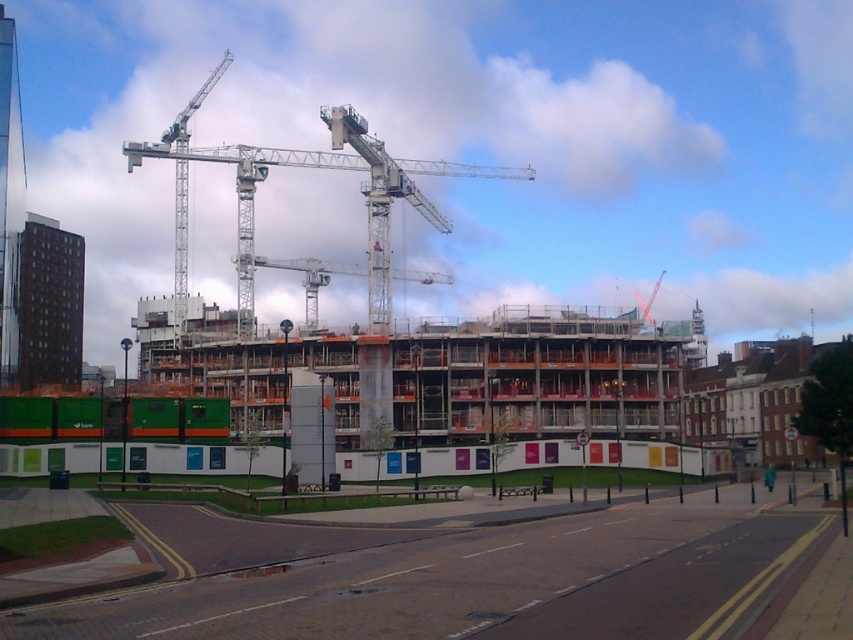
You are a delivery driver approaching the construction site. You need to determine if your truck, which is 12 meters long, can pass through the gap between the concrete wall at center and the white metallic crane at upper center. Can it fit?

The concrete wall at center is smaller than the white metallic crane at upper center, but the exact dimensions of the gap aren

You are a delivery truck driver who needs to pass through the construction site. The concrete wall at center and the white metallic crane at upper center are in your path. Based on their widths, which one might require more caution to avoid collision?

The white metallic crane at upper center has a greater width than the concrete wall at center, so it might require more caution to avoid collision.

You are a delivery driver approaching the construction site. You need to deliver a package to the building behind the white metallic crane at upper center. Can you see the building through the concrete wall at center from your current position?

The concrete wall at center is in front of the white metallic crane at upper center, so it is blocking your view of the building behind the white metallic crane at upper center. You cannot see the building through the concrete wall at center from your current position.